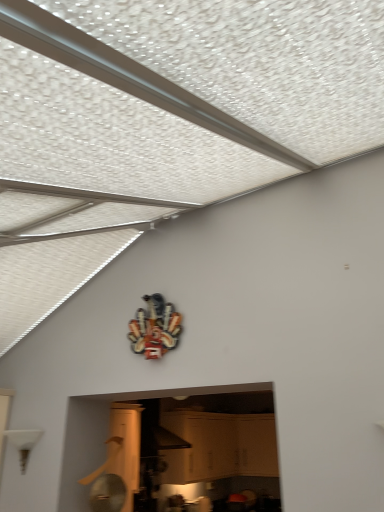
Question: Is metallic multi-tool at upper center to the left or to the right of white matte cabinet at center in the image?

Choices:
 (A) right
 (B) left

Answer: (B)

Question: Considering the positions of metallic multi-tool at upper center and white matte cabinet at center in the image, is metallic multi-tool at upper center wider or thinner than white matte cabinet at center?

Choices:
 (A) wide
 (B) thin

Answer: (B)

Question: Is metallic multi-tool at upper center in front of or behind white matte cabinet at center in the image?

Choices:
 (A) front
 (B) behind

Answer: (A)

Question: From the image's perspective, is white matte cabinet at center above or below metallic multi-tool at upper center?

Choices:
 (A) above
 (B) below

Answer: (B)

Question: From a real-world perspective, relative to metallic multi-tool at upper center, is white matte cabinet at center vertically above or below?

Choices:
 (A) below
 (B) above

Answer: (A)

Question: Is point (183, 458) closer or farther from the camera than point (175, 339)?

Choices:
 (A) closer
 (B) farther

Answer: (B)

Question: In terms of height, does white matte cabinet at center look taller or shorter compared to metallic multi-tool at upper center?

Choices:
 (A) tall
 (B) short

Answer: (A)